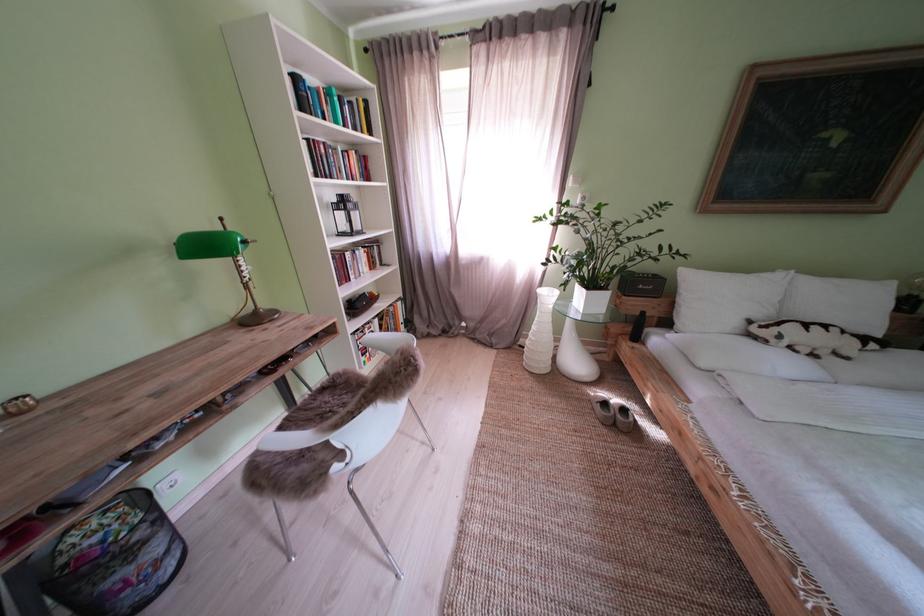
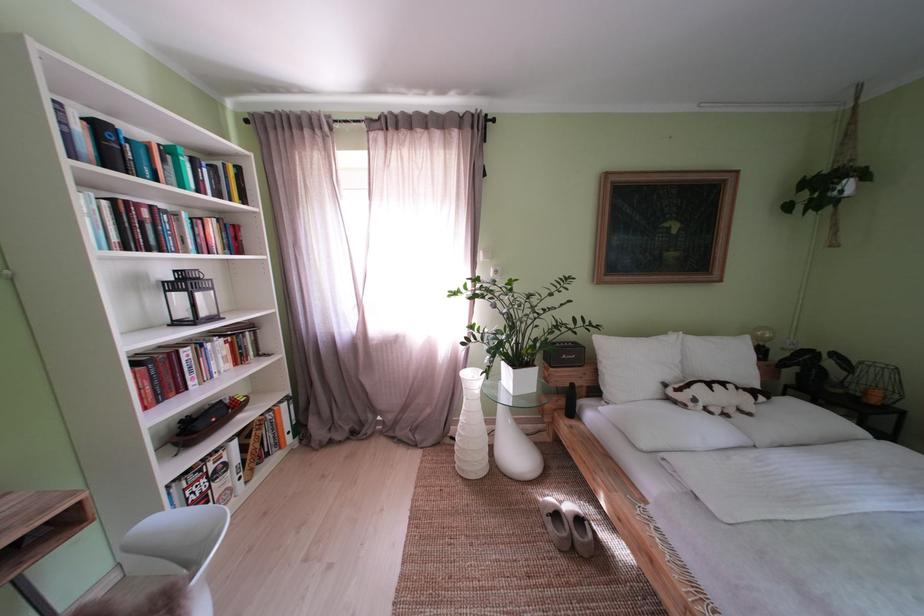
Where in the second image is the point corresponding to point (544, 331) from the first image?

(472, 424)